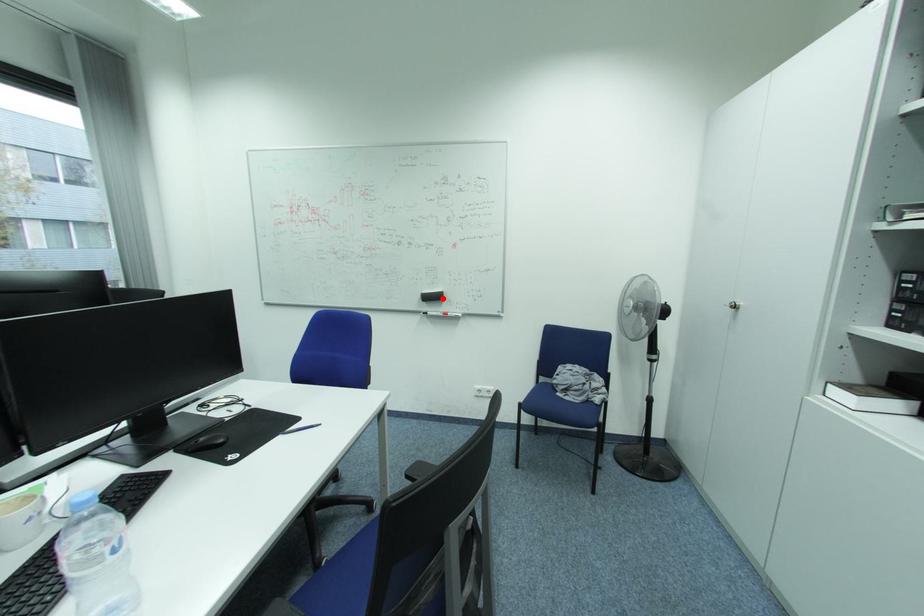
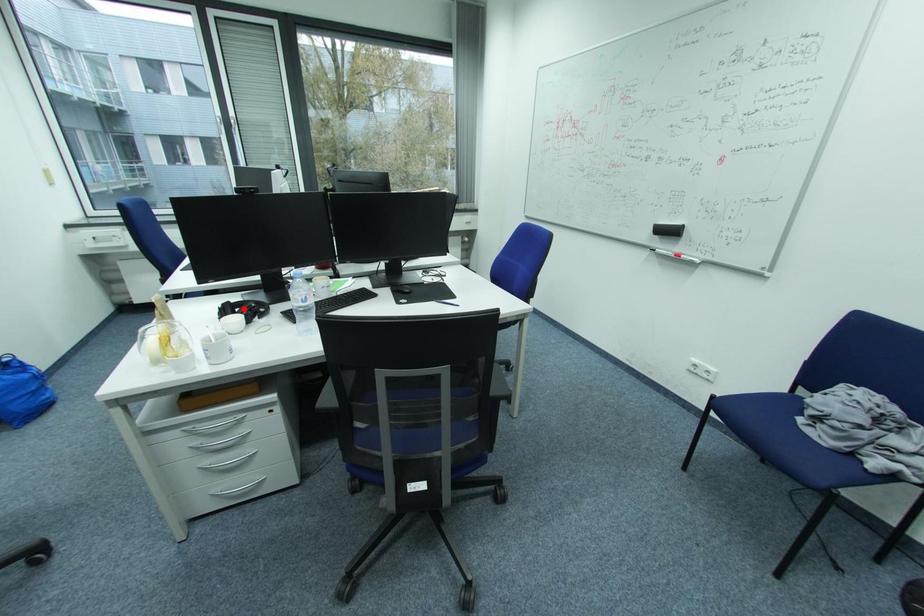
I am providing you with two images of the same scene from different viewpoints. A red point is marked on the first image and another point is marked on the second image. Are the points marked in image1 and image2 representing the same 3D position?

No